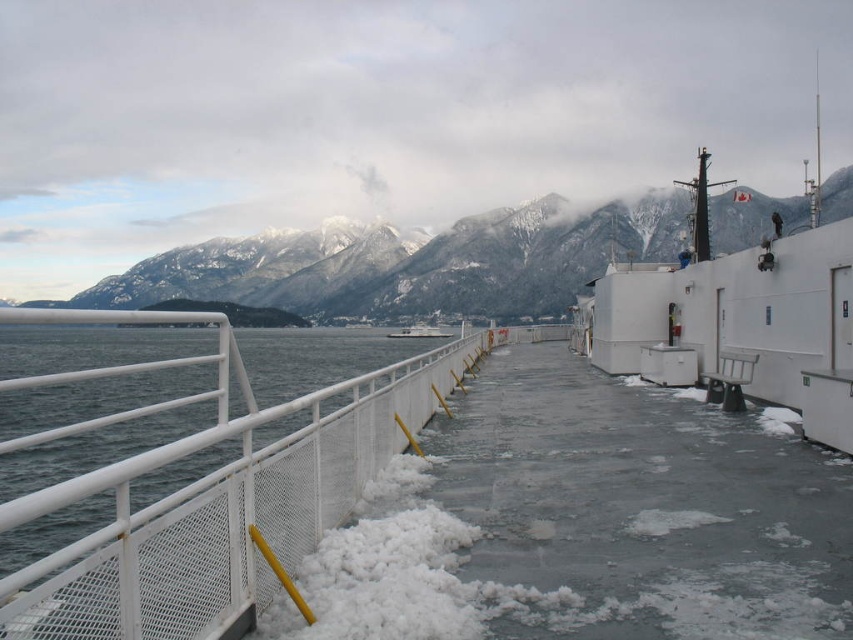
Consider the image. Can you confirm if snowy mountain at upper center is positioned below white matte boat at center?

Actually, snowy mountain at upper center is above white matte boat at center.

Is point (450, 236) farther from camera compared to point (403, 326)?

Yes.

Identify the location of snowy mountain at upper center. The height and width of the screenshot is (640, 853). (409, 262).

Does point (196, 499) come behind point (337, 268)?

No, it is in front of (337, 268).

Who is lower down, white ice at left or snowy mountain at upper center?

white ice at left

Which is in front, point (277, 529) or point (469, 241)?

Point (277, 529)

This screenshot has width=853, height=640. I want to click on white ice at left, so click(x=219, y=513).

Is white ice at left bigger than white matte boat at center?

Yes.

Locate an element on the screen. The height and width of the screenshot is (640, 853). white ice at left is located at coordinates (219, 513).

Does point (148, 470) come in front of point (430, 332)?

Yes, it is in front of point (430, 332).

The image size is (853, 640). Find the location of `white ice at left`. white ice at left is located at coordinates (219, 513).